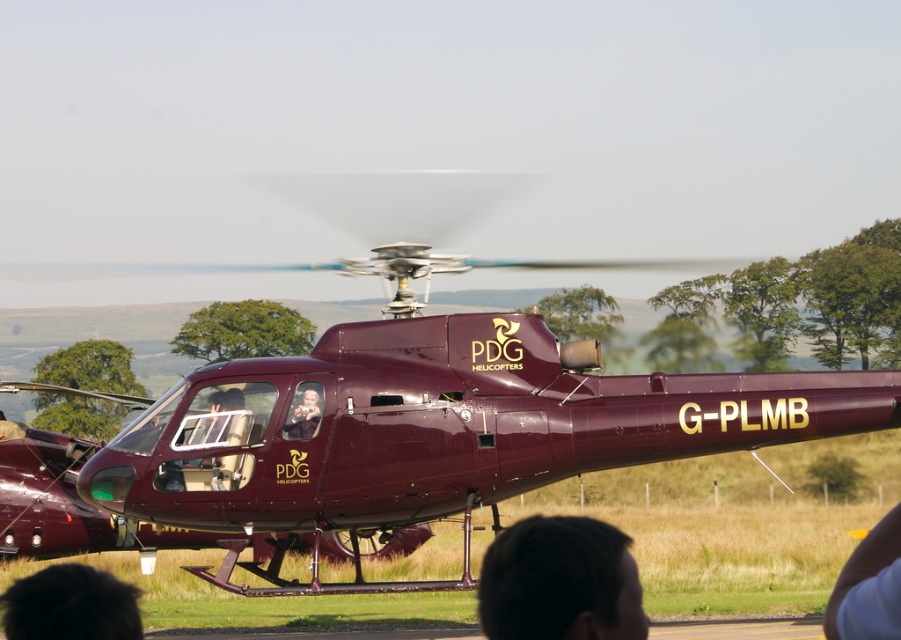
Is dark brown hair at lower center taller than smooth plastic baby at center?

Correct, dark brown hair at lower center is much taller as smooth plastic baby at center.

Is dark brown hair at lower center smaller than smooth plastic baby at center?

No.

Who is more distant from viewer, (x=624, y=612) or (x=303, y=406)?

Point (x=303, y=406)

What are the coordinates of `dark brown hair at lower center` in the screenshot? It's located at (560, 580).

In the scene shown: Between maroon glossy helicopter at center and dark hair at lower left, which one has more height?

maroon glossy helicopter at center

Is point (149, 481) behind point (38, 609)?

Yes.

Find the location of a particular element. Image resolution: width=901 pixels, height=640 pixels. maroon glossy helicopter at center is located at coordinates (424, 404).

You are a GUI agent. You are given a task and a screenshot of the screen. Output one action in this format:
    pyautogui.click(x=<x>, y=<y>)
    Task: Click on the maroon glossy helicopter at center
    This screenshot has height=640, width=901.
    Given the screenshot: What is the action you would take?
    pyautogui.click(x=424, y=404)

Is point (396, 326) less distant than point (287, 416)?

No, (396, 326) is further to viewer.

Find the location of a particular element. This screenshot has height=640, width=901. maroon glossy helicopter at center is located at coordinates (424, 404).